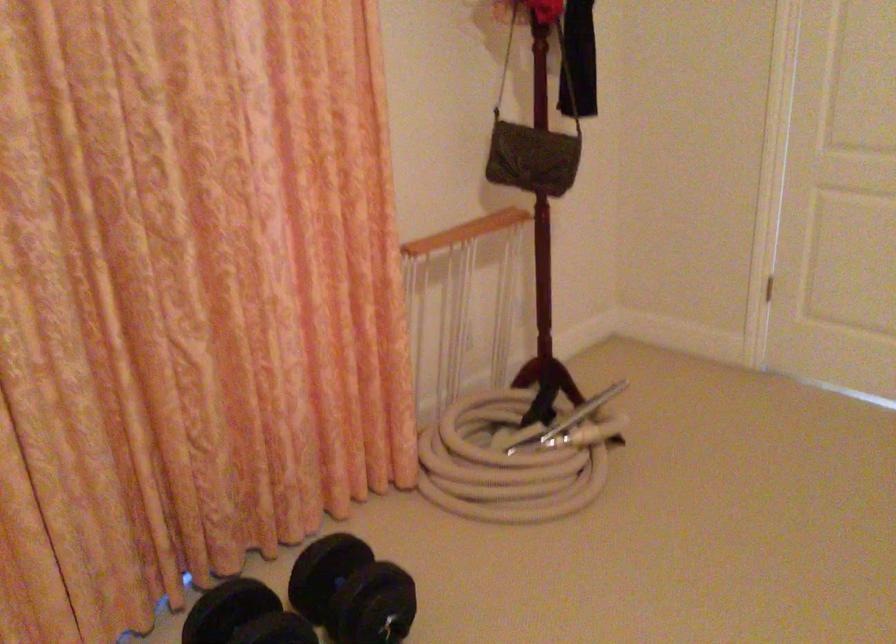
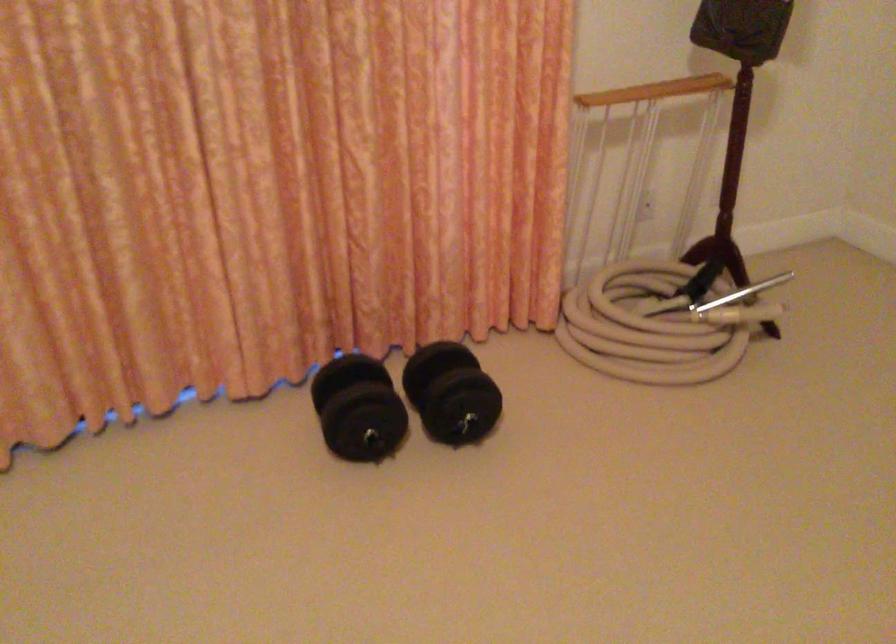
The point at (510, 213) is marked in the first image. Where is the corresponding point in the second image?

(711, 78)